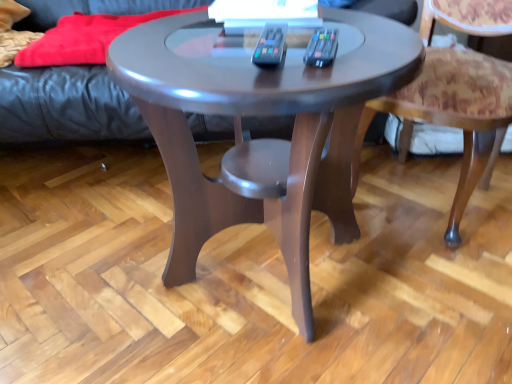
Where is `vacant area that is in front of patterned fabric chair at lower right`? This screenshot has width=512, height=384. vacant area that is in front of patterned fabric chair at lower right is located at coordinates (450, 283).